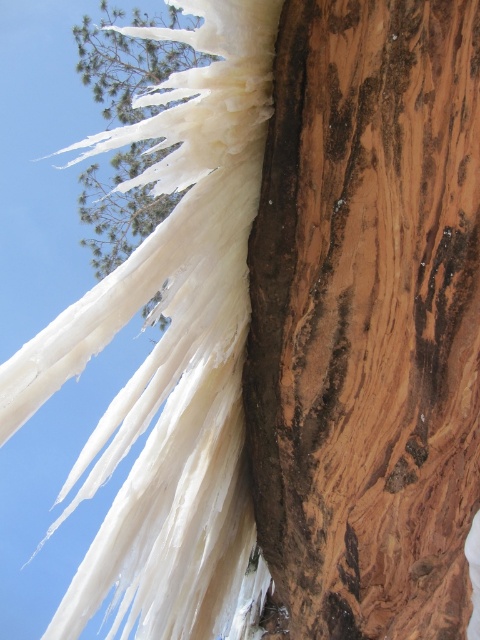
You are an artist sketching the scene and want to ensure the proportions are accurate. Based on the image, which object is taller between the brown wood at center and the white frosty tree at upper left?

The brown wood at center is taller than the white frosty tree at upper left according to the description.

You are standing in front of the tree trunk with icicles. There are two points marked on the image at coordinates point (384, 38) and point (136, 38). Which point is closer to you?

Point (384, 38) is closer to the viewer than point (136, 38).

You are standing in a winter forest and see the brown wood at center and the white frosty tree at upper left. Which object is nearer to you?

The brown wood at center is closer to the viewer than the white frosty tree at upper left.